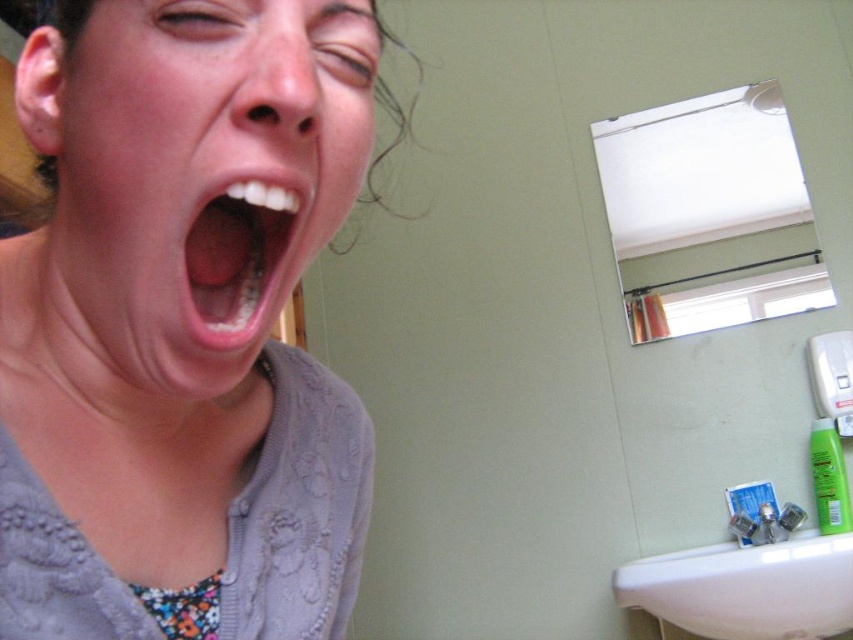
Question: Is the position of matte gray sweater at center less distant than that of white ceramic sink at lower right?

Choices:
 (A) yes
 (B) no

Answer: (A)

Question: Which point appears farthest from the camera in this image?

Choices:
 (A) (224, 316)
 (B) (80, 522)
 (C) (721, 570)
 (D) (131, 362)

Answer: (C)

Question: Among these points, which one is farthest from the camera?

Choices:
 (A) click(248, 282)
 (B) click(758, 484)
 (C) click(102, 10)

Answer: (B)

Question: Does pink flesh-colored face at center appear on the right side of white ceramic sink at lower right?

Choices:
 (A) yes
 (B) no

Answer: (B)

Question: Among these objects, which one is nearest to the camera?

Choices:
 (A) white ceramic sink at lower right
 (B) pink flesh-colored face at center

Answer: (B)

Question: Does matte gray sweater at center appear under blue matte toothpaste at sink right?

Choices:
 (A) no
 (B) yes

Answer: (A)